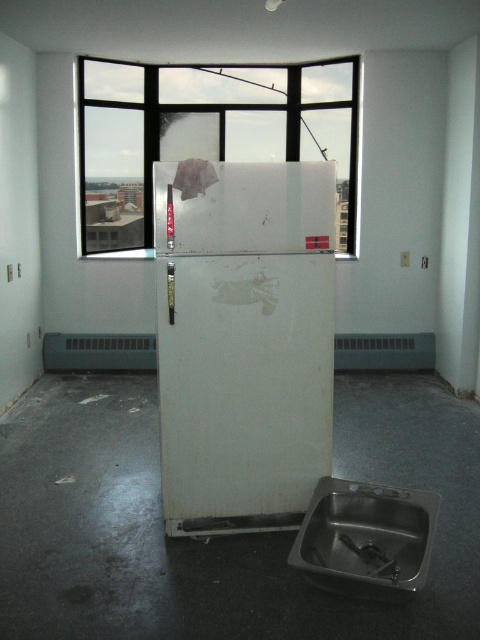
Question: Where is white matte refrigerator at center located in relation to transparent glass window at center in the image?

Choices:
 (A) above
 (B) below

Answer: (B)

Question: Which point is farther to the camera?

Choices:
 (A) (419, 499)
 (B) (217, 84)
 (C) (367, 550)

Answer: (B)

Question: Does stainless steel sink at lower right appear over satin nickel faucet at lower right?

Choices:
 (A) no
 (B) yes

Answer: (B)

Question: Which is farther from the transparent glass window at center?

Choices:
 (A) stainless steel sink at lower right
 (B) white matte refrigerator at center
 (C) satin nickel faucet at lower right

Answer: (C)

Question: Which is nearer to the stainless steel sink at lower right?

Choices:
 (A) transparent glass window at center
 (B) satin nickel faucet at lower right

Answer: (B)

Question: Does transparent glass window at center appear over satin nickel faucet at lower right?

Choices:
 (A) yes
 (B) no

Answer: (A)